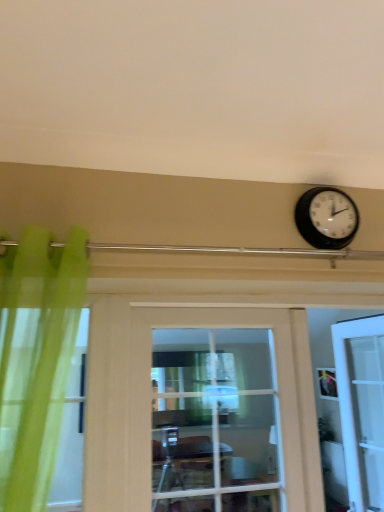
Question: Does clear glass door at center, the 2th door when ordered from right to left, have a lesser width compared to black plastic wall clock at upper right?

Choices:
 (A) no
 (B) yes

Answer: (A)

Question: Can you confirm if clear glass door at center, the 2th door when ordered from right to left, is positioned to the right of black plastic wall clock at upper right?

Choices:
 (A) no
 (B) yes

Answer: (A)

Question: Does clear glass door at center, arranged as the first door when viewed from the front, turn towards black plastic wall clock at upper right?

Choices:
 (A) yes
 (B) no

Answer: (B)

Question: From the image's perspective, is clear glass door at center, which is the 1th door from left to right, located beneath black plastic wall clock at upper right?

Choices:
 (A) yes
 (B) no

Answer: (A)

Question: Does clear glass door at center, the second door from the back, have a greater width compared to black plastic wall clock at upper right?

Choices:
 (A) no
 (B) yes

Answer: (B)

Question: Is clear glass door at center, the 2th door when ordered from right to left, positioned behind black plastic wall clock at upper right?

Choices:
 (A) yes
 (B) no

Answer: (B)

Question: Does white glossy door at right, marked as the first door in a back-to-front arrangement, appear on the right side of clear glass door at center, which is the 1th door from left to right?

Choices:
 (A) no
 (B) yes

Answer: (B)

Question: Are white glossy door at right, marked as the first door in a back-to-front arrangement, and clear glass door at center, arranged as the first door when viewed from the front, located far from each other?

Choices:
 (A) yes
 (B) no

Answer: (B)

Question: Is the position of white glossy door at right, marked as the first door in a back-to-front arrangement, more distant than that of clear glass door at center, the 2th door when ordered from right to left?

Choices:
 (A) no
 (B) yes

Answer: (B)

Question: From the image's perspective, is white glossy door at right, which ranks as the 2th door in left-to-right order, located above clear glass door at center, the second door from the back?

Choices:
 (A) yes
 (B) no

Answer: (B)

Question: Is clear glass door at center, which is the 1th door from left to right, inside white glossy door at right, marked as the first door in a back-to-front arrangement?

Choices:
 (A) yes
 (B) no

Answer: (B)

Question: Can you confirm if white glossy door at right, which ranks as the 2th door in left-to-right order, is positioned to the left of clear glass door at center, the second door from the back?

Choices:
 (A) no
 (B) yes

Answer: (A)

Question: Considering the relative positions of black plastic wall clock at upper right and white glossy door at right, which is the 2th door in front-to-back order, in the image provided, is black plastic wall clock at upper right behind white glossy door at right, which is the 2th door in front-to-back order,?

Choices:
 (A) no
 (B) yes

Answer: (A)